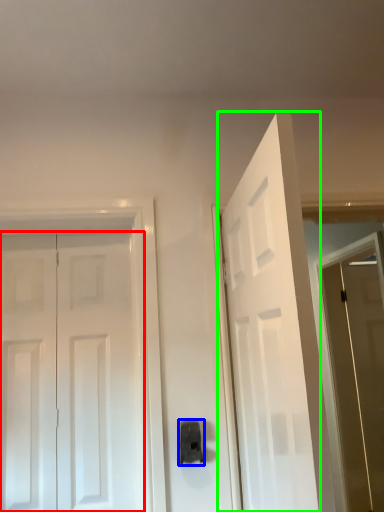
Question: Which object is positioned closest to door (highlighted by a red box)? Select from door handle (highlighted by a blue box) and door (highlighted by a green box).

Choices:
 (A) door handle
 (B) door

Answer: (A)